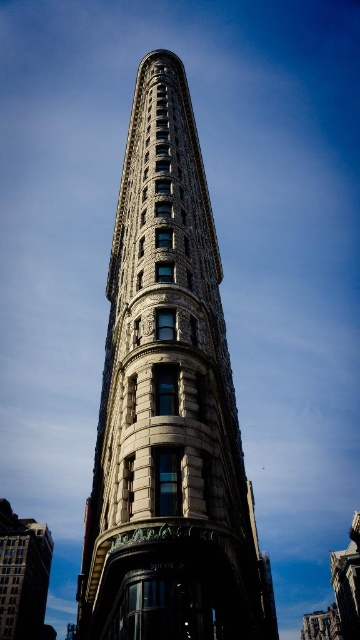
Question: Is stone textured building at center above white stone building at lower left?

Choices:
 (A) no
 (B) yes

Answer: (B)

Question: Does stone textured building at center lie behind white stone building at lower left?

Choices:
 (A) no
 (B) yes

Answer: (A)

Question: Among these objects, which one is farthest from the camera?

Choices:
 (A) white stone building at lower left
 (B) stone textured building at center

Answer: (A)

Question: Is stone textured building at center to the left of white stone building at lower left from the viewer's perspective?

Choices:
 (A) no
 (B) yes

Answer: (A)

Question: Which point is closer to the camera?

Choices:
 (A) (2, 609)
 (B) (183, 132)

Answer: (B)

Question: Which object is closer to the camera taking this photo?

Choices:
 (A) stone textured building at center
 (B) white stone building at lower left

Answer: (A)